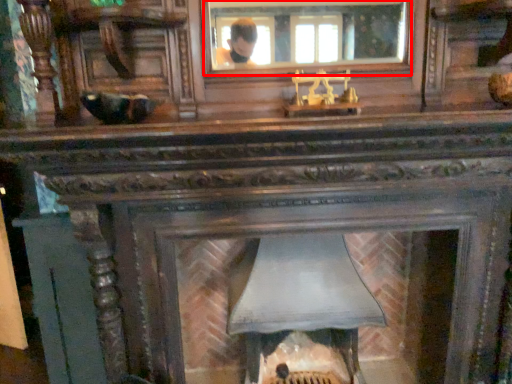
Question: In this image, where is mirror (annotated by the red box) located relative to fireplace?

Choices:
 (A) left
 (B) right

Answer: (A)